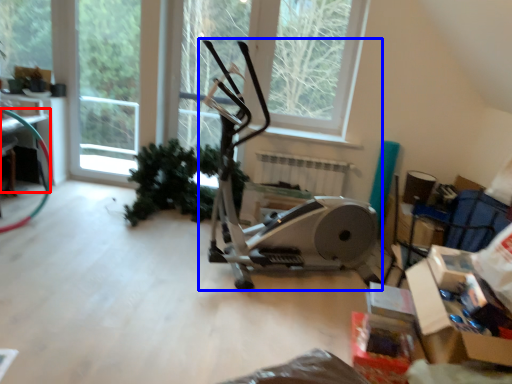
Question: Among these objects, which one is farthest to the camera, table (highlighted by a red box) or stationary bicycle (highlighted by a blue box)?

Choices:
 (A) table
 (B) stationary bicycle

Answer: (A)